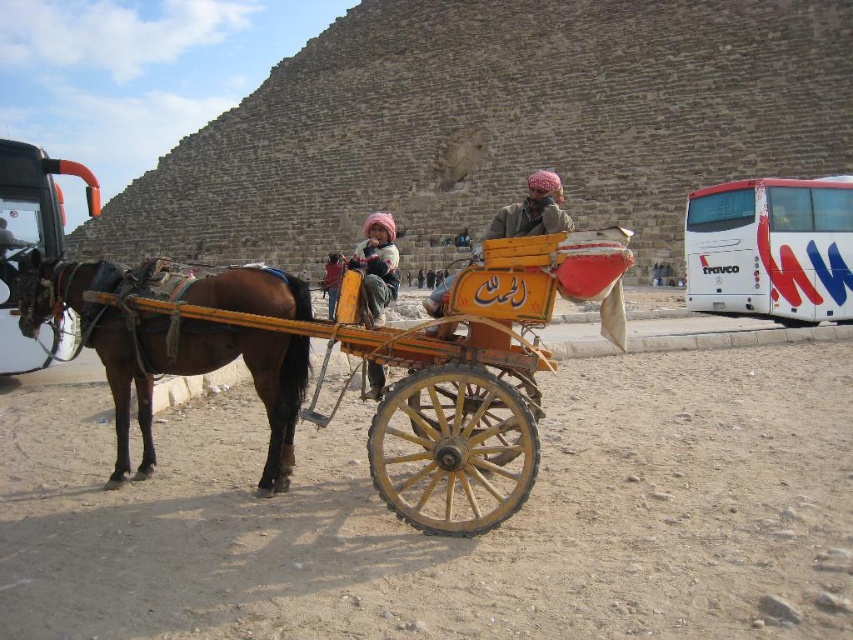
Question: Is brown glossy horse at left positioned before soft pink fabric at center?

Choices:
 (A) yes
 (B) no

Answer: (A)

Question: Which of the following is the closest to the observer?

Choices:
 (A) (143, 362)
 (B) (364, 298)
 (C) (341, 259)

Answer: (A)

Question: Which point is closer to the camera?

Choices:
 (A) click(334, 288)
 (B) click(465, 387)
 (C) click(306, 369)
 (D) click(368, 256)

Answer: (B)

Question: Does wooden cart at center appear on the right side of yellow fabric headscarf at center?

Choices:
 (A) yes
 (B) no

Answer: (A)

Question: Which point is closer to the camera?

Choices:
 (A) (21, 314)
 (B) (340, 280)
 (C) (537, 428)

Answer: (C)

Question: Is soft pink fabric at center closer to camera compared to yellow fabric headscarf at center?

Choices:
 (A) yes
 (B) no

Answer: (A)